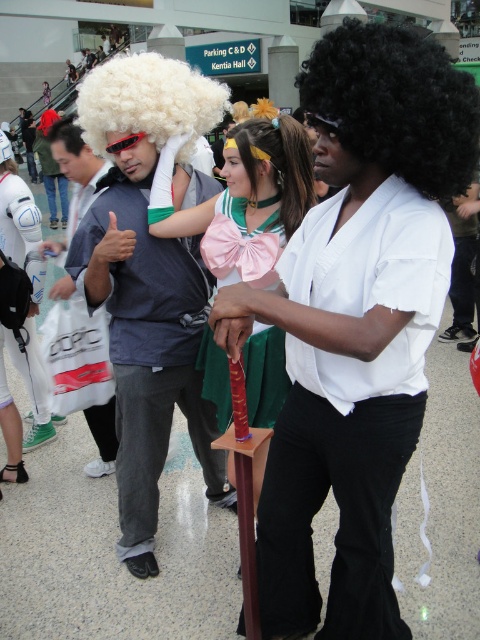
You are an event organizer checking the entrance area. You notice the pink satin bow at center and the white matte backpack at left. Which object is taller?

The pink satin bow at center is taller than the white matte backpack at left.

You are a photographer at the event and need to take a group photo of the white curly wig at upper left and the matte black wig at left. Which wig will be more visible in the photo?

The white curly wig at upper left is in front of the matte black wig at left, so it will be more visible in the photo.

You are a photographer at the event and want to take a photo of both the white fluffy wig at center and the black curly wig at center. The camera you are using has a maximum focus range of 1.2 meters. Will both wigs be in focus?

The white fluffy wig at center and black curly wig at center are 1.18 meters apart, which is within the camera maximum focus range of 1.2 meters. Therefore, both wigs will be in focus.